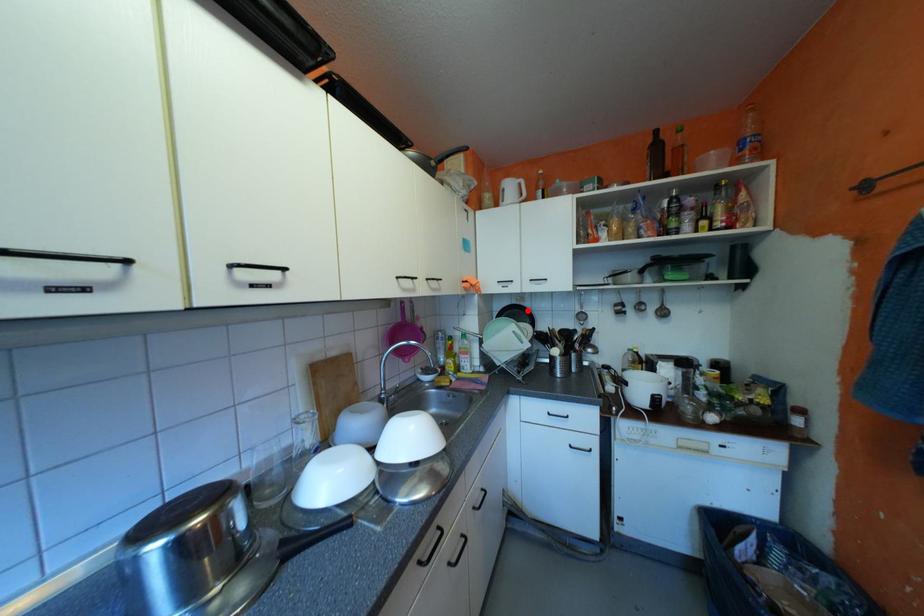
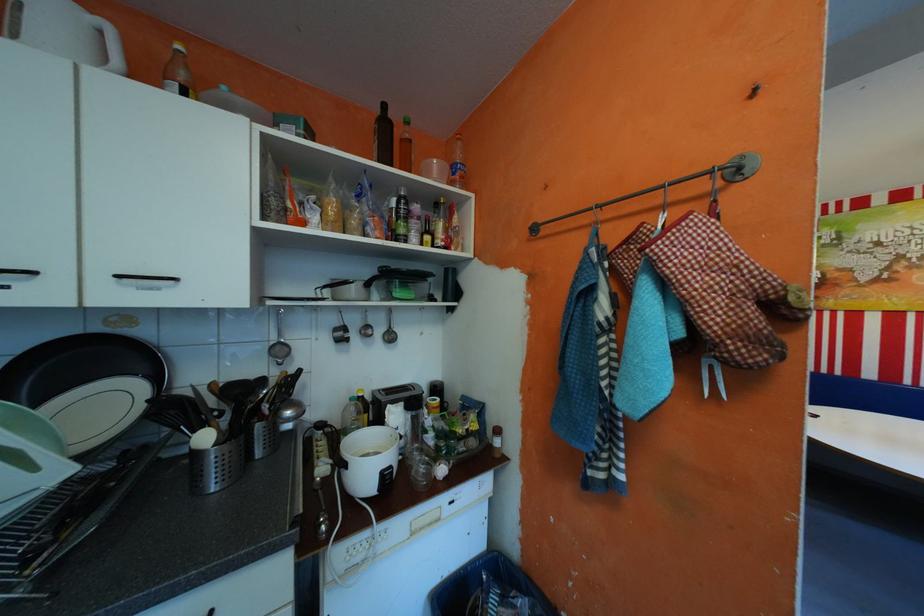
Locate, in the second image, the point that corresponds to the highlighted location in the first image.

(105, 353)